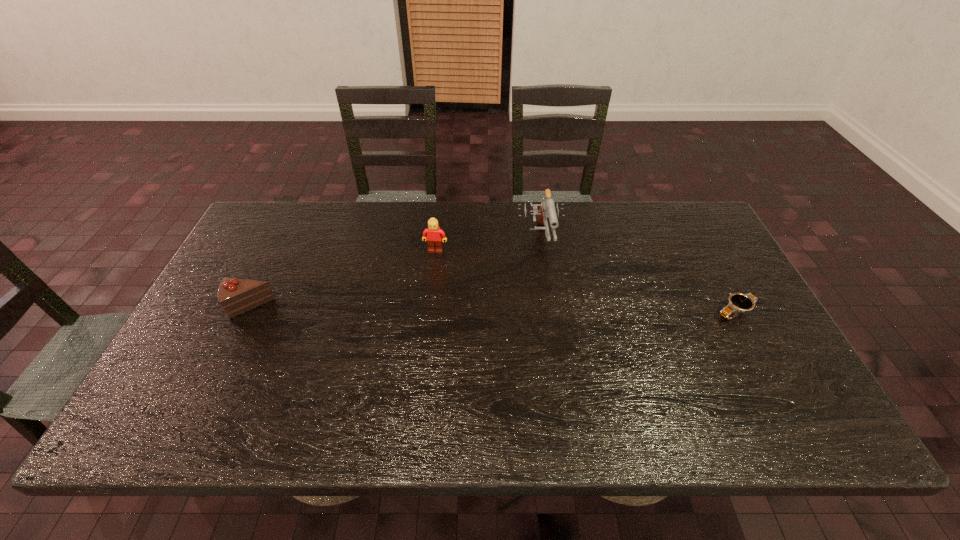
The image size is (960, 540). What are the coordinates of `free spot at the far edge of the desktop` in the screenshot? It's located at (489, 218).

I want to click on vacant space at the near edge, so click(x=266, y=391).

The width and height of the screenshot is (960, 540). In order to click on vacant space at the left edge of the desktop in this screenshot , I will do `click(253, 333)`.

Image resolution: width=960 pixels, height=540 pixels. I want to click on free region at the right edge, so click(737, 289).

This screenshot has width=960, height=540. Identify the location of free region at the far left corner. pyautogui.click(x=255, y=232).

In order to click on free region at the near left corner of the desktop in this screenshot , I will do `click(232, 373)`.

In the image, there is a desktop. Identify the location of free region at the far right corner. (658, 222).

Where is `vacant space at the near right corner`? The image size is (960, 540). vacant space at the near right corner is located at coordinates (751, 388).

Where is `vacant region between the Lego and the rightmost object`? This screenshot has width=960, height=540. vacant region between the Lego and the rightmost object is located at coordinates (586, 281).

Identify the location of vacant space that is in between the third object from left to right and the shortest object. Image resolution: width=960 pixels, height=540 pixels. (637, 276).